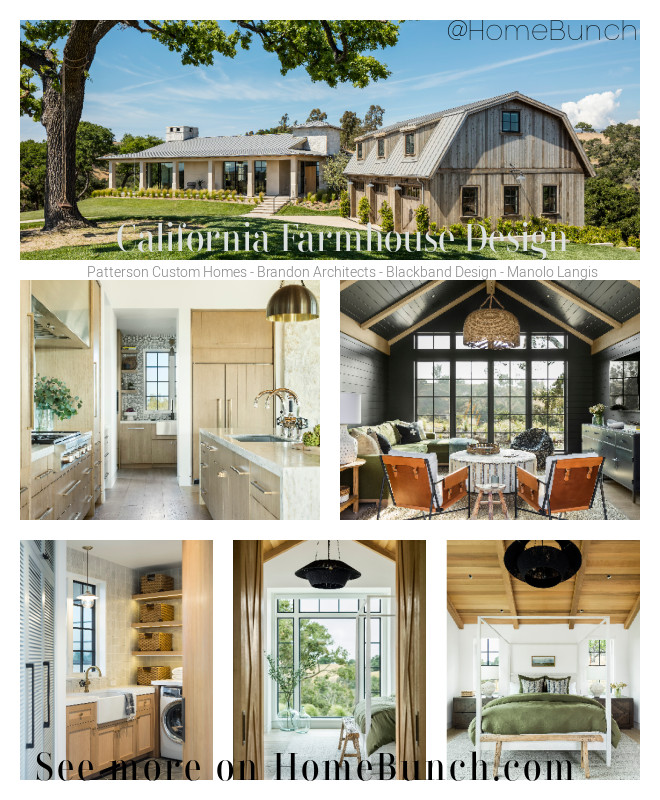
I want to click on faucet, so click(86, 670).